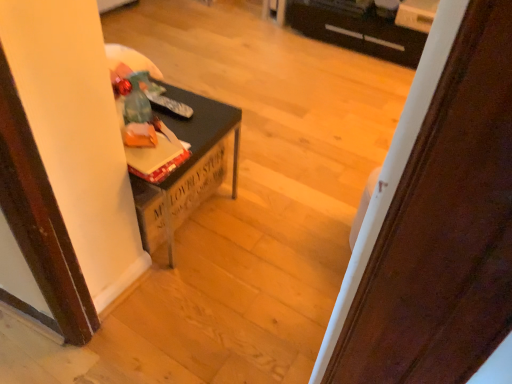
Question: Considering the relative sizes of black plastic drawer at upper center and wooden door at center in the image provided, is black plastic drawer at upper center thinner than wooden door at center?

Choices:
 (A) no
 (B) yes

Answer: (A)

Question: From a real-world perspective, is black plastic drawer at upper center on top of wooden door at center?

Choices:
 (A) no
 (B) yes

Answer: (A)

Question: Is black plastic drawer at upper center far from wooden door at center?

Choices:
 (A) yes
 (B) no

Answer: (A)

Question: Is black plastic drawer at upper center to the right of wooden door at center from the viewer's perspective?

Choices:
 (A) no
 (B) yes

Answer: (B)

Question: Considering the relative positions of black plastic drawer at upper center and wooden door at center in the image provided, is black plastic drawer at upper center to the left of wooden door at center from the viewer's perspective?

Choices:
 (A) yes
 (B) no

Answer: (B)

Question: Based on their positions, is matte black table at left located to the left or right of wooden door at center?

Choices:
 (A) left
 (B) right

Answer: (A)

Question: Considering their positions, is matte black table at left located in front of or behind wooden door at center?

Choices:
 (A) front
 (B) behind

Answer: (B)

Question: From a real-world perspective, is matte black table at left physically located above or below wooden door at center?

Choices:
 (A) above
 (B) below

Answer: (B)

Question: Based on their sizes in the image, would you say matte black table at left is bigger or smaller than wooden door at center?

Choices:
 (A) big
 (B) small

Answer: (A)

Question: In the image, is black plastic drawer at upper center on the left side or the right side of wooden door at center?

Choices:
 (A) left
 (B) right

Answer: (B)

Question: From a real-world perspective, relative to wooden door at center, is black plastic drawer at upper center vertically above or below?

Choices:
 (A) above
 (B) below

Answer: (B)

Question: In terms of size, does black plastic drawer at upper center appear bigger or smaller than wooden door at center?

Choices:
 (A) big
 (B) small

Answer: (A)

Question: Is black plastic drawer at upper center in front of or behind wooden door at center in the image?

Choices:
 (A) front
 (B) behind

Answer: (B)

Question: Considering the positions of wooden door at center and matte black table at left in the image, is wooden door at center wider or thinner than matte black table at left?

Choices:
 (A) wide
 (B) thin

Answer: (B)

Question: From a real-world perspective, relative to matte black table at left, is wooden door at center vertically above or below?

Choices:
 (A) below
 (B) above

Answer: (B)